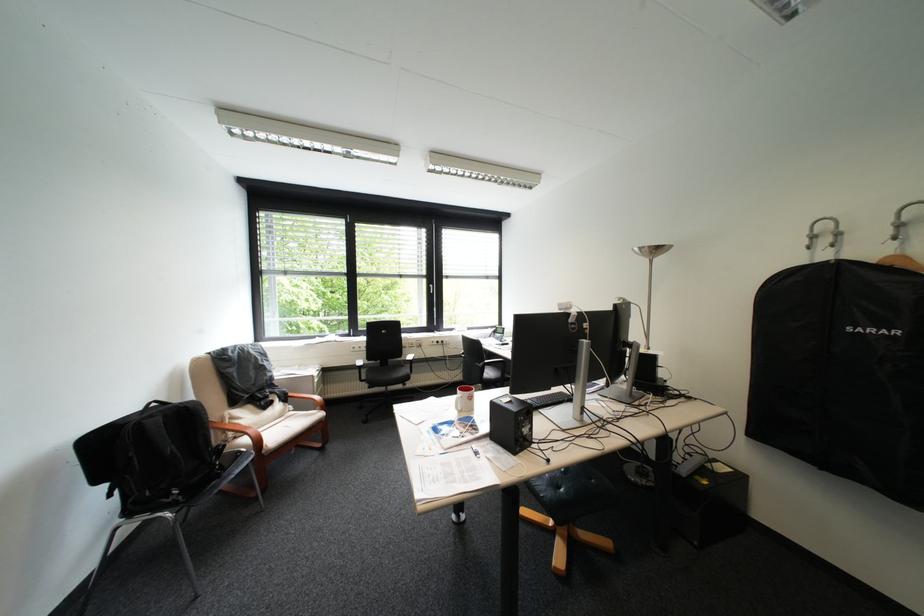
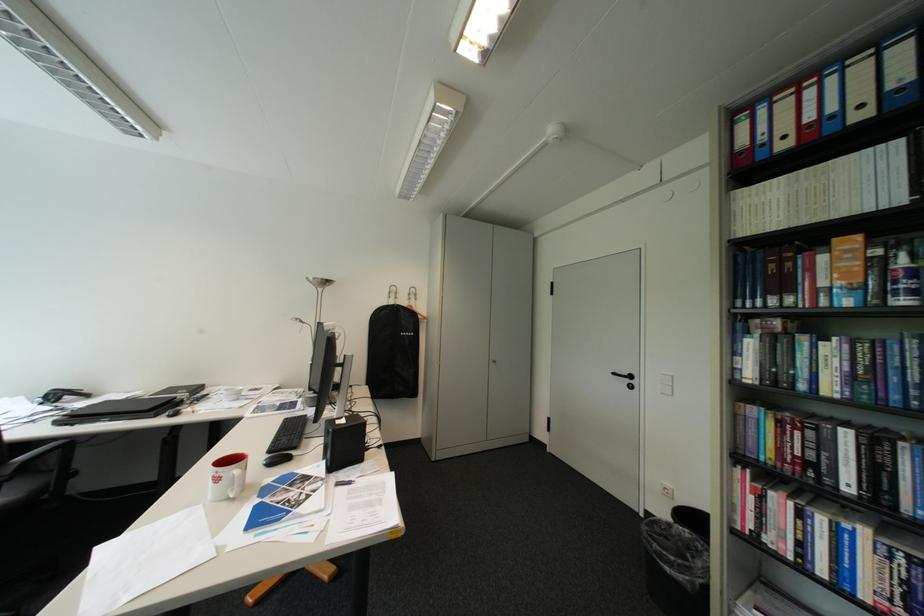
In the second image, find the point that corresponds to the point at 850,235 in the first image.

(408, 294)